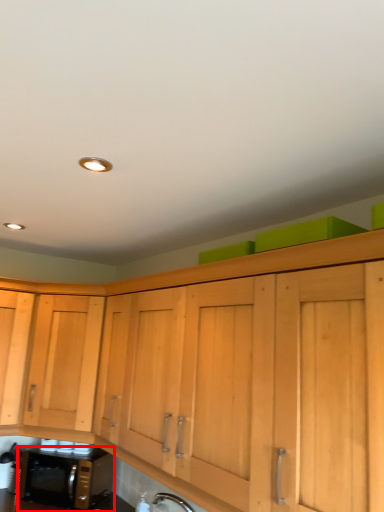
Question: From the image's perspective, considering the relative positions of microwave oven (annotated by the red box) and cabinetry in the image provided, where is microwave oven (annotated by the red box) located with respect to the staircase?

Choices:
 (A) above
 (B) below

Answer: (B)